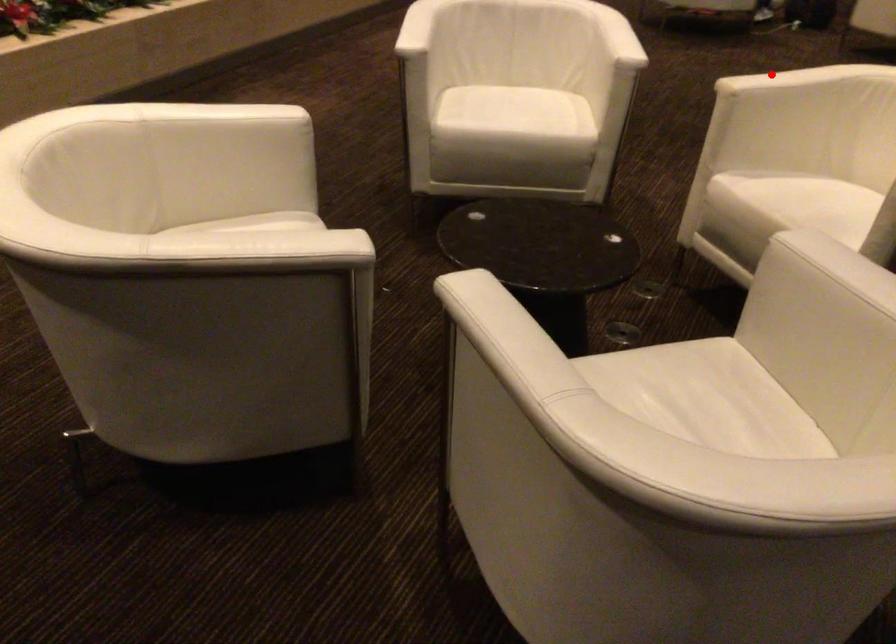
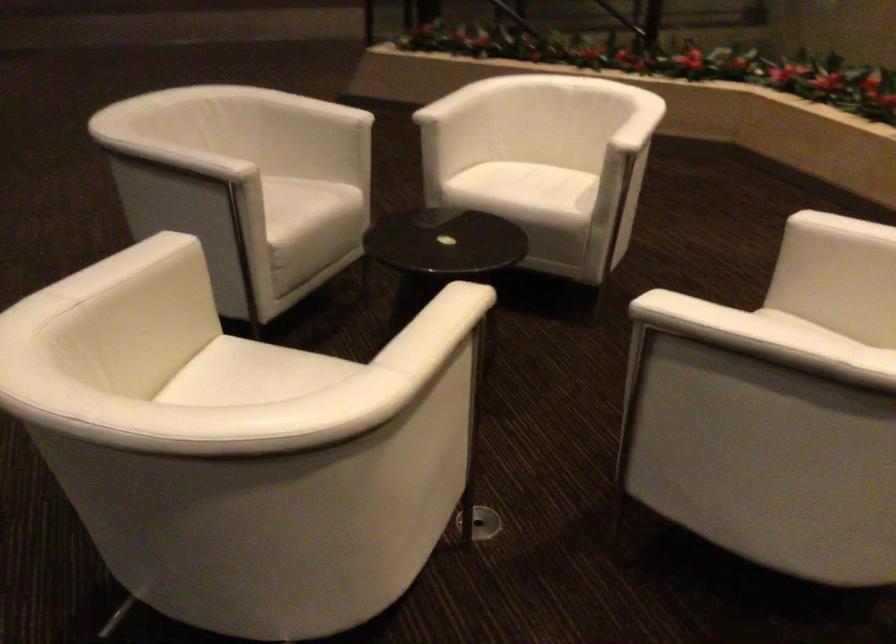
Question: I am providing you with two images of the same scene from different viewpoints. A red point is marked on the first image. At the location where the point appears in image 1, is it still visible in image 2?

Choices:
 (A) Yes
 (B) No

Answer: (A)